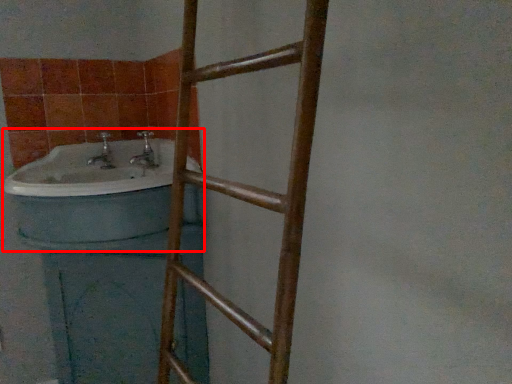
Question: From the image's perspective, what is the correct spatial positioning of sink (annotated by the red box) in reference to ladder?

Choices:
 (A) below
 (B) above

Answer: (B)